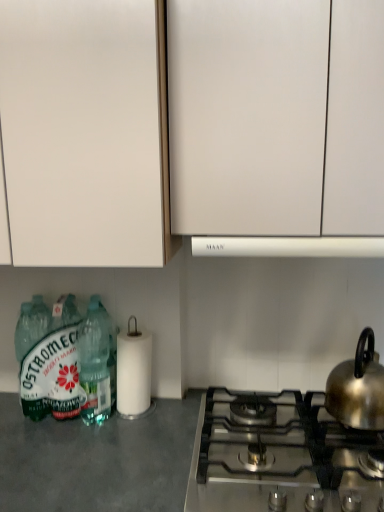
Question: From a real-world perspective, is shiny metallic kettle at right above or below white matte cabinet at upper left, placed as the 1th cabinetry when sorted from left to right?

Choices:
 (A) above
 (B) below

Answer: (B)

Question: Looking at the image, does shiny metallic kettle at right seem bigger or smaller compared to white matte cabinet at upper left, placed as the 1th cabinetry when sorted from left to right?

Choices:
 (A) big
 (B) small

Answer: (B)

Question: Which is nearer to the gray matte countertop at lower left?

Choices:
 (A) satin silver gas stove at lower right
 (B) translucent plastic bottles at lower left, arranged as the 1th bottle when viewed from the right
 (C) white matte paper towel at lower center
 (D) white matte vent at center
 (E) green matte bottle at lower left, the first bottle viewed from the left

Answer: (B)

Question: Which is farther from the white matte vent at center?

Choices:
 (A) gray matte countertop at lower left
 (B) satin silver gas stove at lower right
 (C) white matte cabinet at upper left, the second cabinetry from the right
 (D) white matte cabinet at upper center, the 2th cabinetry in the left-to-right sequence
 (E) green matte bottle at lower left, the first bottle viewed from the left

Answer: (A)